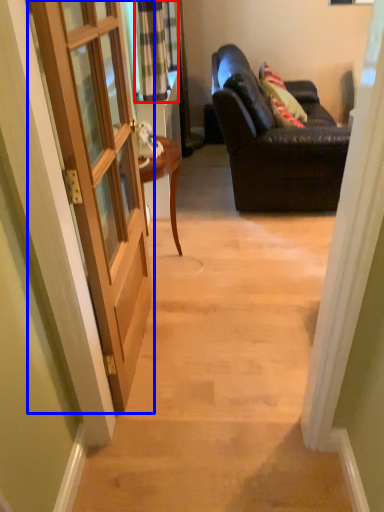
Question: Which of the following is the farthest to the observer, curtain (highlighted by a red box) or door (highlighted by a blue box)?

Choices:
 (A) curtain
 (B) door

Answer: (A)